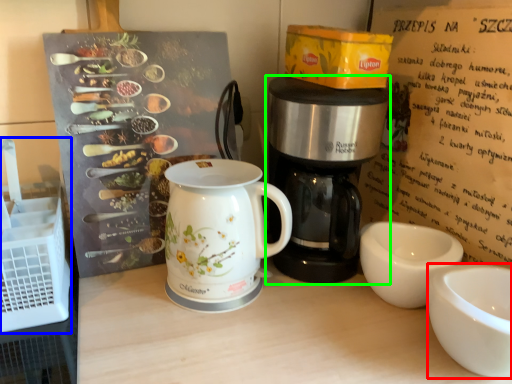
Question: Which object is positioned closest to coffee cup (highlighted by a red box)? Select from crate (highlighted by a blue box) and coffee maker (highlighted by a green box).

Choices:
 (A) crate
 (B) coffee maker

Answer: (B)